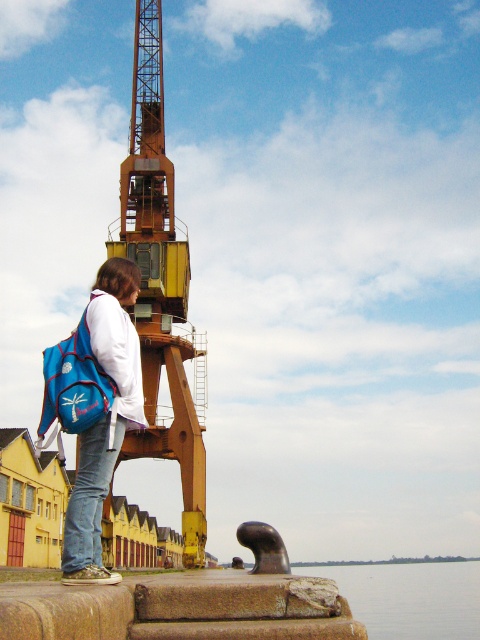
Which is in front, point (137, 307) or point (91, 541)?

Point (91, 541) is more forward.

Which of these two, yellow painted metal crane at center or jeans at lower left, stands shorter?

jeans at lower left is shorter.

Between point (159, 148) and point (85, 534), which one is positioned behind?

The point (159, 148) is more distant.

Identify the location of yellow painted metal crane at center. (160, 285).

This screenshot has height=640, width=480. What do you see at coordinates (160, 285) in the screenshot?
I see `yellow painted metal crane at center` at bounding box center [160, 285].

Between point (136, 170) and point (325, 572), which one is positioned behind?

Point (325, 572)

Identify the location of yellow painted metal crane at center. The width and height of the screenshot is (480, 640). [160, 285].

Does point (137, 426) come in front of point (85, 440)?

No, it is behind (85, 440).

Does blue fabric backpack at center have a larger size compared to jeans at lower left?

Correct, blue fabric backpack at center is larger in size than jeans at lower left.

Image resolution: width=480 pixels, height=640 pixels. I want to click on blue fabric backpack at center, so click(104, 419).